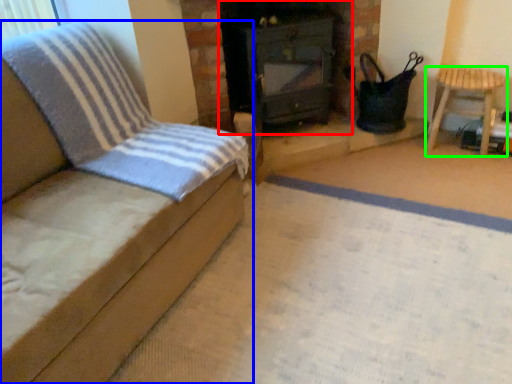
Question: Considering the real-world distances, which object is closest to stove (highlighted by a red box)? furniture (highlighted by a blue box) or furniture (highlighted by a green box).

Choices:
 (A) furniture
 (B) furniture

Answer: (B)